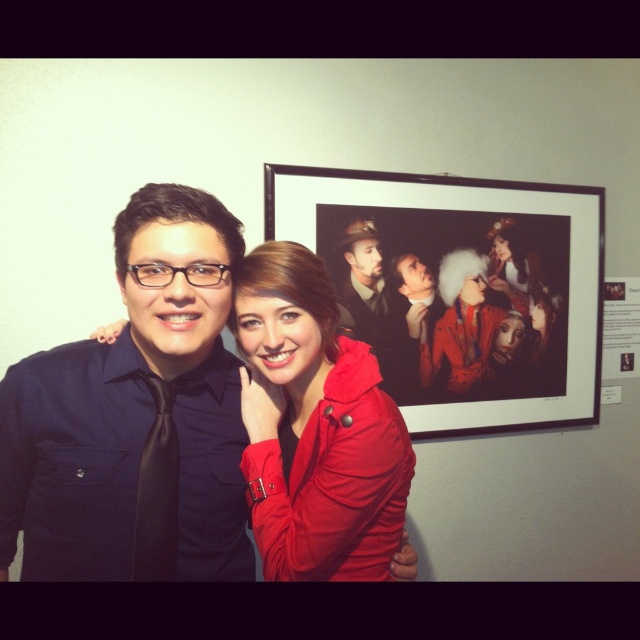
Question: Can you confirm if matte black suit at center is thinner than black silk tie at left?

Choices:
 (A) no
 (B) yes

Answer: (A)

Question: Which object is farther from the camera taking this photo?

Choices:
 (A) matte red coat at center
 (B) black silk tie at left

Answer: (A)

Question: Is matte black suit at center to the right of black silk tie at left from the viewer's perspective?

Choices:
 (A) no
 (B) yes

Answer: (B)

Question: Can you confirm if black matte picture frame at upper right is smaller than matte black suit at center?

Choices:
 (A) no
 (B) yes

Answer: (A)

Question: Which of these objects is positioned closest to the matte black shirt at left?

Choices:
 (A) white paper at upper right
 (B) black silk tie at left
 (C) matte black suit at center
 (D) black matte picture frame at upper right

Answer: (B)

Question: Which point appears farthest from the camera in this image?

Choices:
 (A) click(132, 554)
 (B) click(275, 301)
 (C) click(625, 356)
 (D) click(388, 282)

Answer: (C)